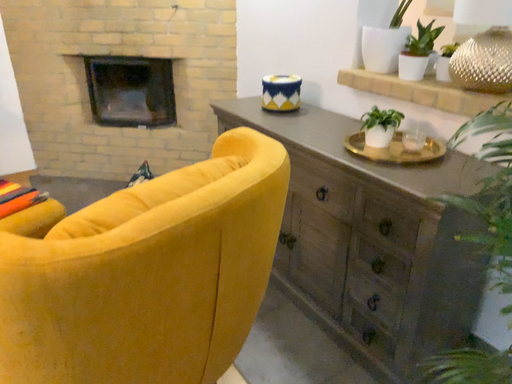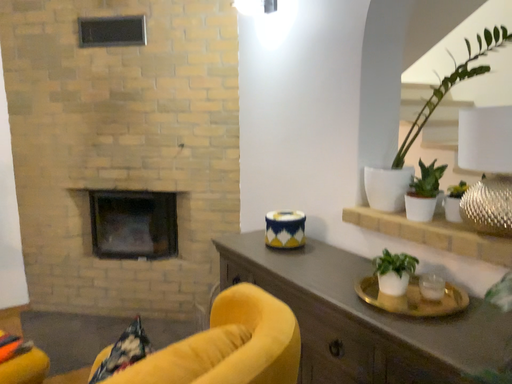
Question: How did the camera likely rotate when shooting the video?

Choices:
 (A) rotated downward
 (B) rotated upward

Answer: (B)